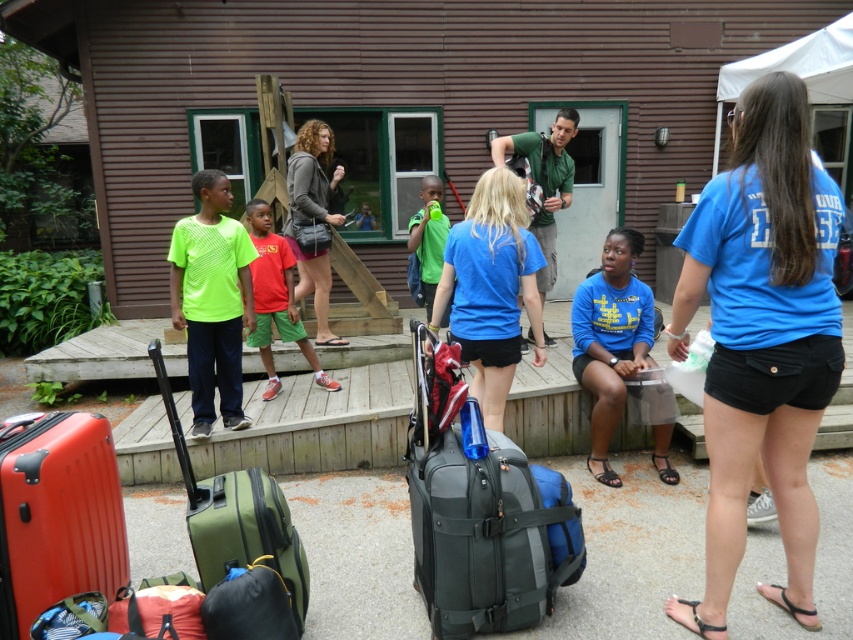
You are packing for a trip and need to decide which item to take first. Based on the scene, which object is bigger between the gray fabric suitcase at center and the green matte shirt at center?

The gray fabric suitcase at center is larger in size compared to the green matte shirt at center, so you should take the gray fabric suitcase at center first.